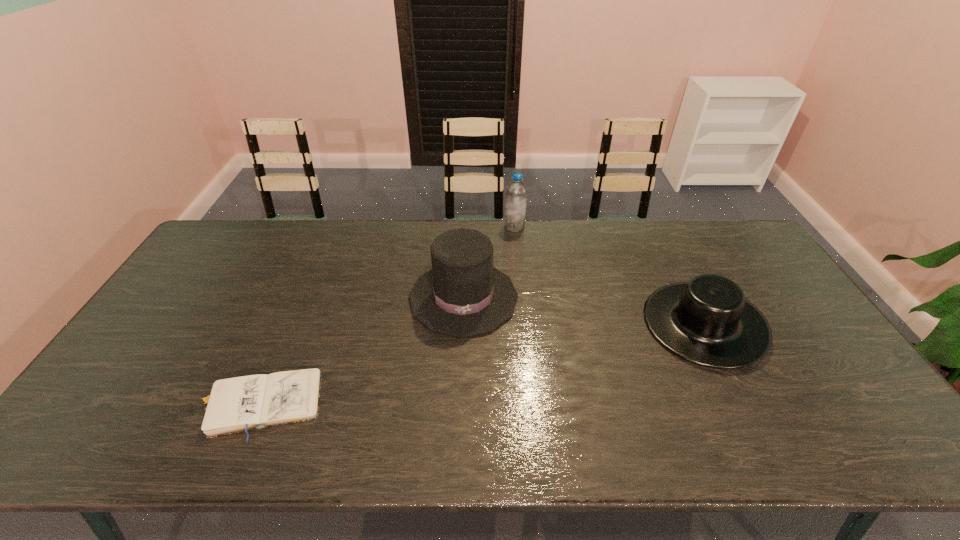
I want to click on empty location between the left dress hat and the shortest object, so click(361, 351).

The width and height of the screenshot is (960, 540). In order to click on free spot between the farthest object and the second shortest object in this screenshot , I will do `click(609, 275)`.

At what (x,y) coordinates should I click in order to perform the action: click on free space that is in between the shortest object and the taller dress hat. Please return your answer as a coordinate pair (x, y). Looking at the image, I should click on (361, 351).

At what (x,y) coordinates should I click in order to perform the action: click on vacant area that lies between the leftmost object and the left dress hat. Please return your answer as a coordinate pair (x, y). This screenshot has width=960, height=540. Looking at the image, I should click on [361, 351].

You are a GUI agent. You are given a task and a screenshot of the screen. Output one action in this format:
    pyautogui.click(x=<x>, y=<y>)
    Task: Click on the free spot between the notebook and the farthest object
    Image resolution: width=960 pixels, height=540 pixels.
    Given the screenshot: What is the action you would take?
    pyautogui.click(x=387, y=315)

Where is `free space between the notebook and the water bottle`? free space between the notebook and the water bottle is located at coordinates (387, 315).

Locate which object ranks in proximity to the leftmost object. Please provide its 2D coordinates. Your answer should be formatted as a tuple, i.e. [(x, y)], where the tuple contains the x and y coordinates of a point satisfying the conditions above.

[(463, 295)]

At what (x,y) coordinates should I click in order to perform the action: click on the closest object to the third tallest object. Please return your answer as a coordinate pair (x, y). Looking at the image, I should click on (463, 295).

Locate an element on the screen. This screenshot has width=960, height=540. vacant area that satisfies the following two spatial constraints: 1. on the front of the rightmost object with the decoration; 2. on the left side of the taller dress hat is located at coordinates (463, 323).

Locate an element on the screen. This screenshot has height=540, width=960. vacant space that satisfies the following two spatial constraints: 1. on the front of the right dress hat with the decoration; 2. on the left side of the taller dress hat is located at coordinates (463, 323).